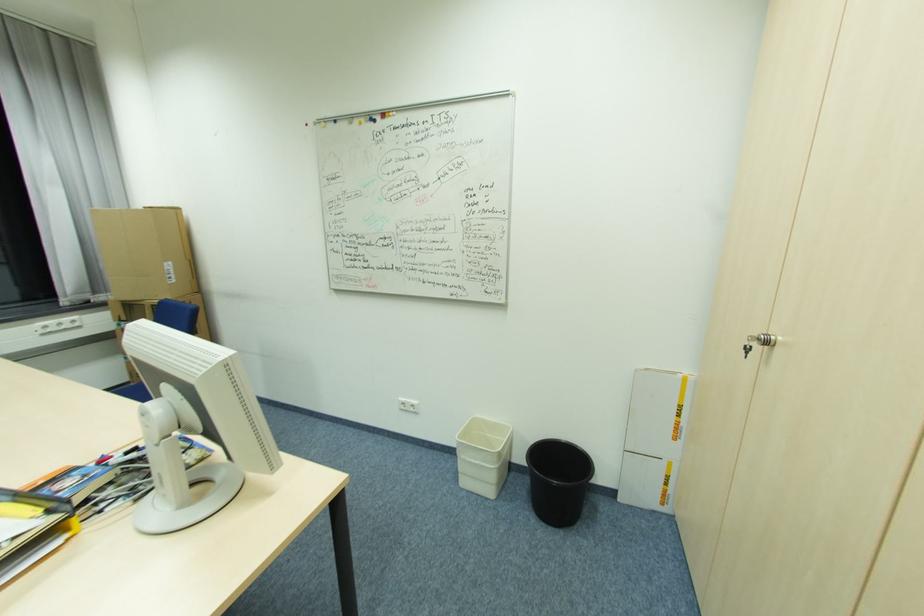
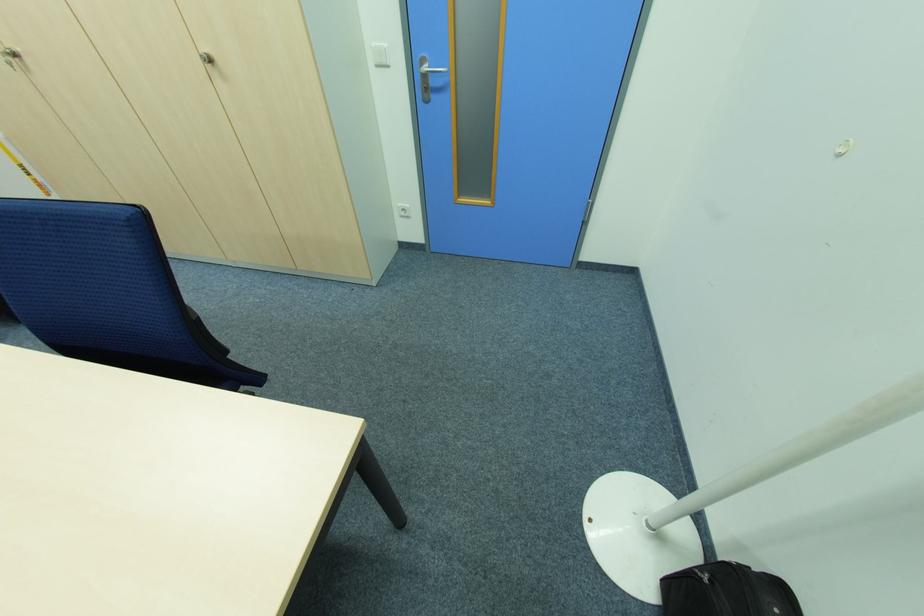
Question: I am providing you with two images of the same scene from different viewpoints. After the viewpoint changes to image2, which objects are now occluded?

Choices:
 (A) black bag
 (B) white light switch
 (C) silver cabinet knob
 (D) none of these

Answer: (D)